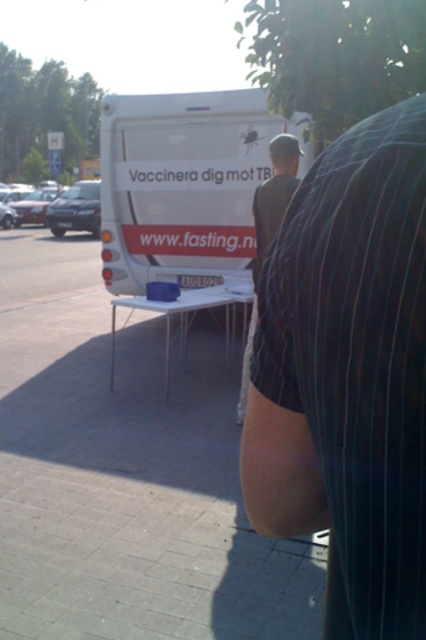
You are a pedestrian walking along the street and see the white matte van at center and the dark gray shirt at center. Which object is positioned to the right side from your perspective?

The dark gray shirt at center is positioned to the right of the white matte van at center.

You are a photographer trying to capture both the black pinstripe shirt at center and the white matte van at center in a single frame. Which object should you focus on first to ensure both are in the frame without zooming in or out?

You should focus on the white matte van at center first because it is wider than the black pinstripe shirt at center, ensuring that the narrower object will fit within the frame.